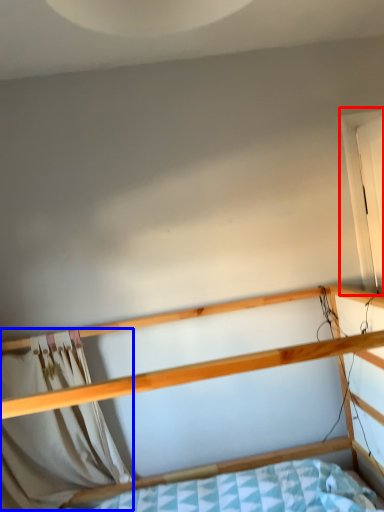
Question: Which object is further to the camera taking this photo, window (highlighted by a red box) or curtain (highlighted by a blue box)?

Choices:
 (A) window
 (B) curtain

Answer: (B)